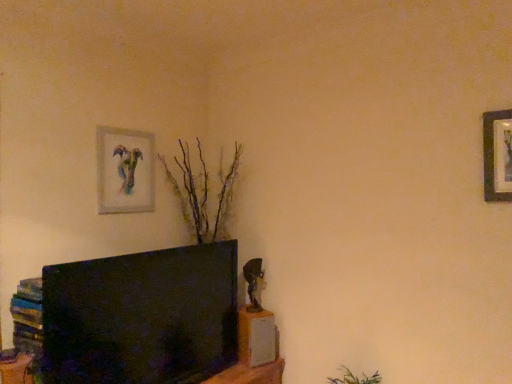
This screenshot has width=512, height=384. I want to click on wooden picture frame at upper right, which is the 2th picture frame in left-to-right order, so 493,155.

From the image's perspective, between watercolor paper painting at upper left, the 1th picture frame in the left-to-right sequence, and wooden bookshelf at lower left, who is located below?

From the image's view, wooden bookshelf at lower left is below.

Considering the relative sizes of watercolor paper painting at upper left, the second picture frame in the right-to-left sequence, and wooden bookshelf at lower left in the image provided, is watercolor paper painting at upper left, the second picture frame in the right-to-left sequence, taller than wooden bookshelf at lower left?

Correct, watercolor paper painting at upper left, the second picture frame in the right-to-left sequence, is much taller as wooden bookshelf at lower left.

From a real-world perspective, relative to wooden bookshelf at lower left, is watercolor paper painting at upper left, arranged as the 2th picture frame when viewed from the front, vertically above or below?

In terms of real-world spatial position, watercolor paper painting at upper left, arranged as the 2th picture frame when viewed from the front, is above wooden bookshelf at lower left.

Do you think watercolor paper painting at upper left, placed as the first picture frame when sorted from back to front, is within wooden bookshelf at lower left, or outside of it?

watercolor paper painting at upper left, placed as the first picture frame when sorted from back to front, is not inside wooden bookshelf at lower left, it's outside.

Which is in front, point (505, 183) or point (126, 201)?

Point (505, 183)

Is wooden picture frame at upper right, the first picture frame from the front, oriented towards watercolor paper painting at upper left, the 1th picture frame in the left-to-right sequence?

No, wooden picture frame at upper right, the first picture frame from the front, is not turned towards watercolor paper painting at upper left, the 1th picture frame in the left-to-right sequence.

Looking at this image, between wooden picture frame at upper right, the first picture frame from the front, and watercolor paper painting at upper left, the second picture frame in the right-to-left sequence, which one appears on the left side from the viewer's perspective?

Positioned to the left is watercolor paper painting at upper left, the second picture frame in the right-to-left sequence.

Does wooden picture frame at upper right, the first picture frame from the front, have a greater height compared to wooden bookshelf at lower left?

Indeed, wooden picture frame at upper right, the first picture frame from the front, has a greater height compared to wooden bookshelf at lower left.

Is wooden picture frame at upper right, the first picture frame from the front, smaller than wooden bookshelf at lower left?

No.

From a real-world perspective, is wooden picture frame at upper right, the first picture frame from the front, under wooden bookshelf at lower left?

No, from a real-world perspective, wooden picture frame at upper right, the first picture frame from the front, is not below wooden bookshelf at lower left.

Which point is more distant from viewer, (13, 383) or (488, 147)?

The point (488, 147) is behind.

Considering the sizes of objects wooden bookshelf at lower left and wooden picture frame at upper right, the first picture frame from the front, in the image provided, who is thinner, wooden bookshelf at lower left or wooden picture frame at upper right, the first picture frame from the front,?

With smaller width is wooden picture frame at upper right, the first picture frame from the front.

From the image's perspective, which picture frame is the 2nd one above the wooden bookshelf at lower left? Please provide its 2D coordinates.

[(493, 155)]

Is wooden bookshelf at lower left next to watercolor paper painting at upper left, the 1th picture frame in the left-to-right sequence, and touching it?

wooden bookshelf at lower left and watercolor paper painting at upper left, the 1th picture frame in the left-to-right sequence, are clearly separated.

Can you confirm if wooden bookshelf at lower left is thinner than watercolor paper painting at upper left, the second picture frame in the right-to-left sequence?

No.

Is wooden bookshelf at lower left to the right of watercolor paper painting at upper left, arranged as the 2th picture frame when viewed from the front, from the viewer's perspective?

In fact, wooden bookshelf at lower left is to the left of watercolor paper painting at upper left, arranged as the 2th picture frame when viewed from the front.

In the scene shown: From the image's perspective, would you say wooden bookshelf at lower left is shown under watercolor paper painting at upper left, arranged as the 2th picture frame when viewed from the front?

Correct, wooden bookshelf at lower left appears lower than watercolor paper painting at upper left, arranged as the 2th picture frame when viewed from the front, in the image.

Considering the relative sizes of watercolor paper painting at upper left, the second picture frame in the right-to-left sequence, and wooden picture frame at upper right, the 2th picture frame in the back-to-front sequence, in the image provided, is watercolor paper painting at upper left, the second picture frame in the right-to-left sequence, taller than wooden picture frame at upper right, the 2th picture frame in the back-to-front sequence,?

Correct, watercolor paper painting at upper left, the second picture frame in the right-to-left sequence, is much taller as wooden picture frame at upper right, the 2th picture frame in the back-to-front sequence.

Can you tell me how much watercolor paper painting at upper left, the 1th picture frame in the left-to-right sequence, and wooden picture frame at upper right, which is the 2th picture frame in left-to-right order, differ in facing direction?

92.3 degrees separate the facing orientations of watercolor paper painting at upper left, the 1th picture frame in the left-to-right sequence, and wooden picture frame at upper right, which is the 2th picture frame in left-to-right order.

Can we say watercolor paper painting at upper left, arranged as the 2th picture frame when viewed from the front, lies outside wooden picture frame at upper right, the first picture frame from the front?

Yes, watercolor paper painting at upper left, arranged as the 2th picture frame when viewed from the front, is not within wooden picture frame at upper right, the first picture frame from the front.

Is watercolor paper painting at upper left, placed as the first picture frame when sorted from back to front, with wooden picture frame at upper right, the 2th picture frame in the back-to-front sequence?

No.

You are a GUI agent. You are given a task and a screenshot of the screen. Output one action in this format:
    pyautogui.click(x=<x>, y=<y>)
    Task: Click on the 1st picture frame directly above the wooden bookshelf at lower left (from a real-world perspective)
    Image resolution: width=512 pixels, height=384 pixels.
    Given the screenshot: What is the action you would take?
    pyautogui.click(x=125, y=171)

You are a GUI agent. You are given a task and a screenshot of the screen. Output one action in this format:
    pyautogui.click(x=<x>, y=<y>)
    Task: Click on the picture frame on the left side of wooden picture frame at upper right, which is the 2th picture frame in left-to-right order
    The height and width of the screenshot is (384, 512).
    Given the screenshot: What is the action you would take?
    pyautogui.click(x=125, y=171)

Estimate the real-world distances between objects in this image. Which object is further from wooden picture frame at upper right, the 2th picture frame in the back-to-front sequence, watercolor paper painting at upper left, the second picture frame in the right-to-left sequence, or wooden bookshelf at lower left?

Based on the image, wooden bookshelf at lower left appears to be further to wooden picture frame at upper right, the 2th picture frame in the back-to-front sequence.

Which object lies further to the anchor point wooden bookshelf at lower left, wooden picture frame at upper right, the 1th picture frame in the right-to-left sequence, or watercolor paper painting at upper left, the 1th picture frame in the left-to-right sequence?

The object further to wooden bookshelf at lower left is wooden picture frame at upper right, the 1th picture frame in the right-to-left sequence.

Based on their spatial positions, is watercolor paper painting at upper left, arranged as the 2th picture frame when viewed from the front, or wooden picture frame at upper right, the 1th picture frame in the right-to-left sequence, further from wooden bookshelf at lower left?

Based on the image, wooden picture frame at upper right, the 1th picture frame in the right-to-left sequence, appears to be further to wooden bookshelf at lower left.

Estimate the real-world distances between objects in this image. Which object is closer to watercolor paper painting at upper left, placed as the first picture frame when sorted from back to front, wooden picture frame at upper right, the first picture frame from the front, or wooden bookshelf at lower left?

wooden bookshelf at lower left is closer to watercolor paper painting at upper left, placed as the first picture frame when sorted from back to front.

Looking at the image, which one is located further to watercolor paper painting at upper left, arranged as the 2th picture frame when viewed from the front, wooden bookshelf at lower left or wooden picture frame at upper right, the 1th picture frame in the right-to-left sequence?

wooden picture frame at upper right, the 1th picture frame in the right-to-left sequence, is further to watercolor paper painting at upper left, arranged as the 2th picture frame when viewed from the front.

Consider the image. Which object lies further to the anchor point wooden picture frame at upper right, the first picture frame from the front, wooden bookshelf at lower left or watercolor paper painting at upper left, placed as the first picture frame when sorted from back to front?

Based on the image, wooden bookshelf at lower left appears to be further to wooden picture frame at upper right, the first picture frame from the front.

Where is `picture frame between wooden bookshelf at lower left and wooden picture frame at upper right, the 1th picture frame in the right-to-left sequence, in the horizontal direction`? This screenshot has height=384, width=512. picture frame between wooden bookshelf at lower left and wooden picture frame at upper right, the 1th picture frame in the right-to-left sequence, in the horizontal direction is located at coordinates (125, 171).